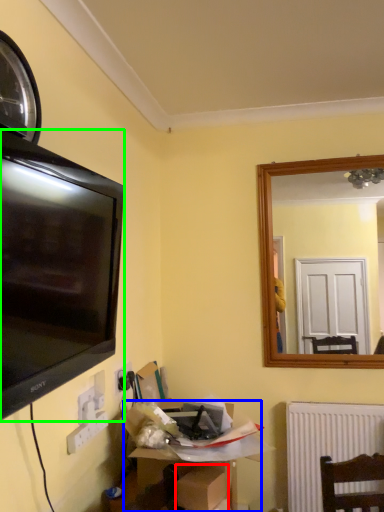
Question: Based on their relative distances, which object is farther from cardboard box (highlighted by a red box)? Choose from cardboard box (highlighted by a blue box) and television (highlighted by a green box).

Choices:
 (A) cardboard box
 (B) television

Answer: (B)